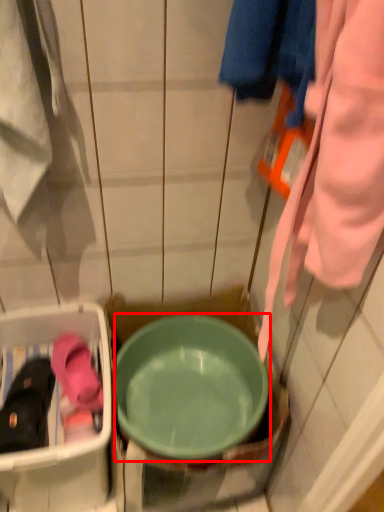
Question: From the image's perspective, where is basin (annotated by the red box) located relative to footwear?

Choices:
 (A) above
 (B) below

Answer: (B)